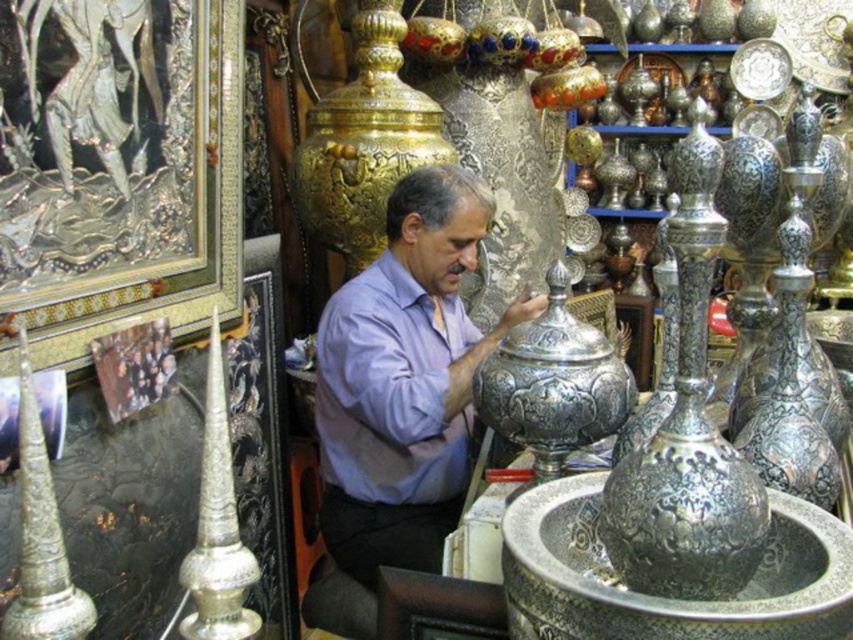
You are standing in the shop and want to take a photo of the purple matte shirt at center without moving the shirt. If your camera is 2.23 meters away from the shirt, is the distance sufficient to capture the entire shirt in the frame?

The purple matte shirt at center and the camera are 2.23 meters apart from each other. This distance is sufficient to capture the entire shirt in the frame as long as the camera has an appropriate zoom or wide angle setting.